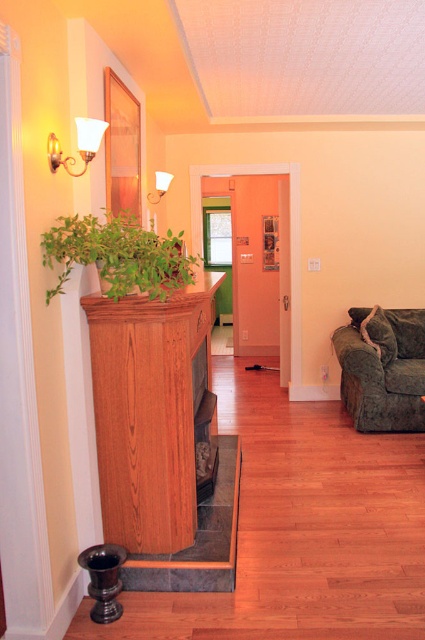
Question: Does velvet green couch at lower right appear over black glossy vase at lower left?

Choices:
 (A) no
 (B) yes

Answer: (B)

Question: Can you confirm if wooden fireplace at left is positioned to the right of velvet green couch at lower right?

Choices:
 (A) no
 (B) yes

Answer: (A)

Question: Estimate the real-world distances between objects in this image. Which object is farther from the matte gold wall sconce at upper left?

Choices:
 (A) velvety gray pillow at right
 (B) velvet green couch at lower right
 (C) black glossy vase at lower left

Answer: (A)

Question: Is wooden fireplace at left to the left of matte gold wall sconce at upper left from the viewer's perspective?

Choices:
 (A) yes
 (B) no

Answer: (B)

Question: Among these objects, which one is farthest from the camera?

Choices:
 (A) velvet green couch at lower right
 (B) wooden fireplace at left

Answer: (A)

Question: Which of the following is the farthest from the observer?

Choices:
 (A) (159, 188)
 (B) (135, 240)

Answer: (A)